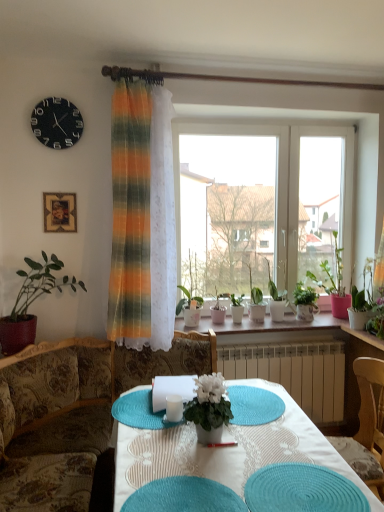
I want to click on vacant region below teal fabric placemat at lower center (from a real-world perspective), so 301,492.